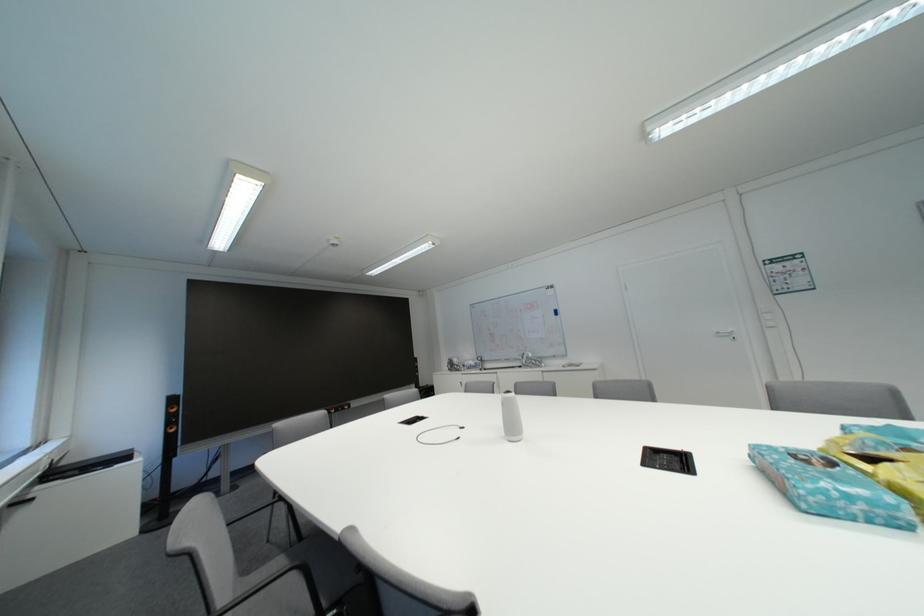
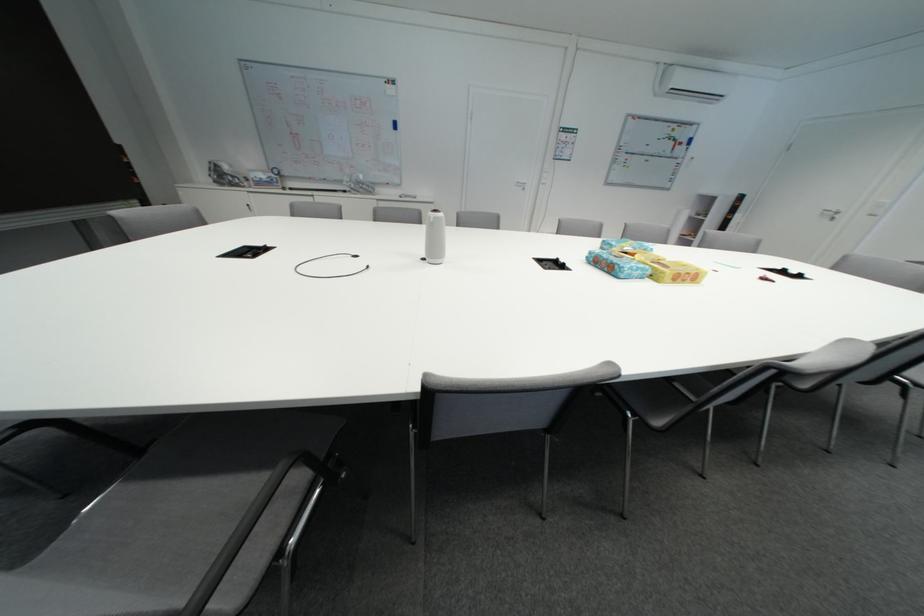
How did the camera likely rotate?

The rotation direction of the camera is right-down.